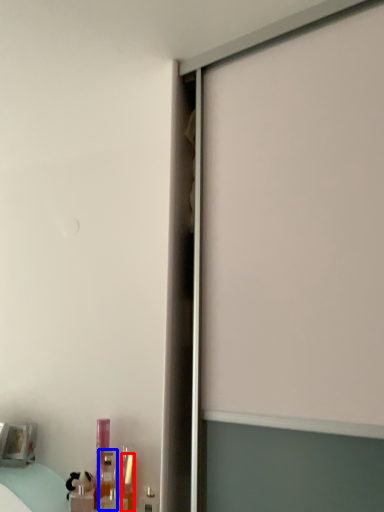
Question: Among these objects, which one is farthest to the camera, toiletry (highlighted by a red box) or toiletry (highlighted by a blue box)?

Choices:
 (A) toiletry
 (B) toiletry

Answer: (B)